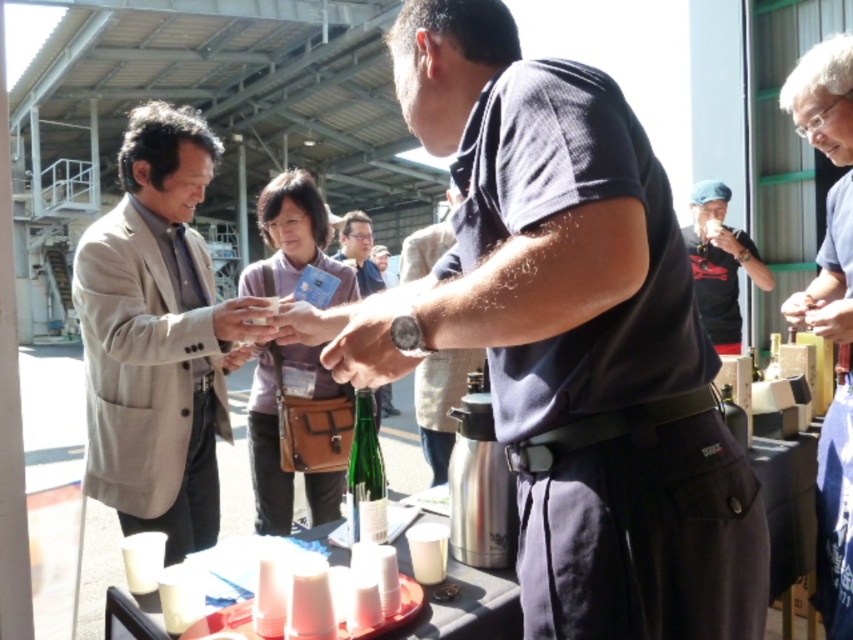
You are a photographer at the event and need to capture a photo that includes both the light beige suit at left and the green glass bottle at center. What is the minimum distance you should keep between the camera and the subjects to ensure both are in frame?

The minimum distance should be at least 24.48 inches to ensure both the light beige suit at left and the green glass bottle at center are within the camera frame since they are 24.48 inches apart.

You are at an outdoor event and see a matte black shirt at center and a green glass bottle at center. Which object is taller?

The matte black shirt at center is taller than the green glass bottle at center.